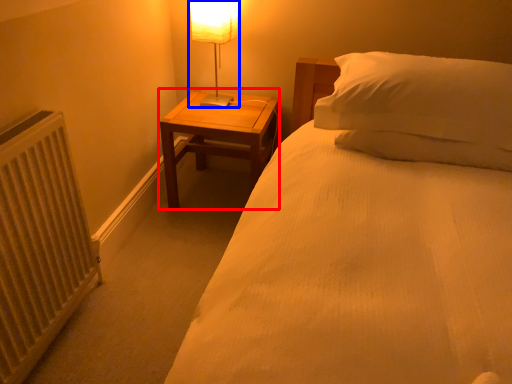
Question: Which of the following is the closest to the observer, nightstand (highlighted by a red box) or table lamp (highlighted by a blue box)?

Choices:
 (A) nightstand
 (B) table lamp

Answer: (B)